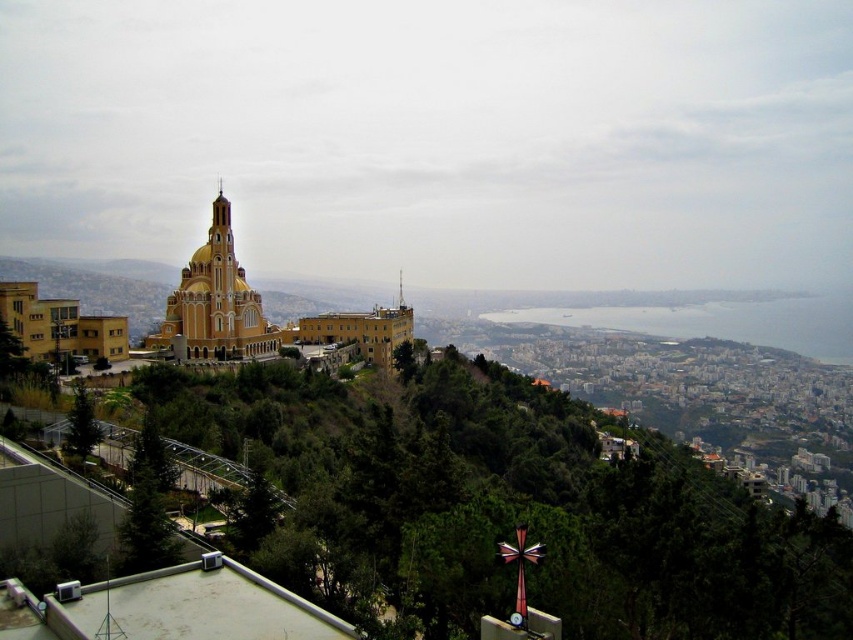
Question: Can you confirm if gold metallic church at center is positioned above yellow matte building at center-left?

Choices:
 (A) yes
 (B) no

Answer: (B)

Question: Is yellow matte building at center-left wider than shiny gold spire at center?

Choices:
 (A) yes
 (B) no

Answer: (A)

Question: Can you confirm if yellow matte building at center-left is positioned to the left of shiny gold spire at center?

Choices:
 (A) no
 (B) yes

Answer: (B)

Question: Estimate the real-world distances between objects in this image. Which object is closer to the shiny gold spire at center?

Choices:
 (A) gold metallic church at center
 (B) yellow matte building at center-left

Answer: (A)

Question: Estimate the real-world distances between objects in this image. Which object is closer to the gold metallic church at center?

Choices:
 (A) shiny gold spire at center
 (B) yellow matte building at center-left

Answer: (B)

Question: Which is farther from the yellow matte building at center-left?

Choices:
 (A) gold metallic church at center
 (B) shiny gold spire at center

Answer: (B)